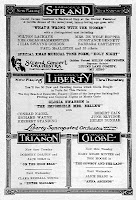
Image resolution: width=136 pixels, height=200 pixels. What are the coordinates of `corner` in the screenshot? It's located at (135, 199), (0, 199), (0, 0), (135, 6).